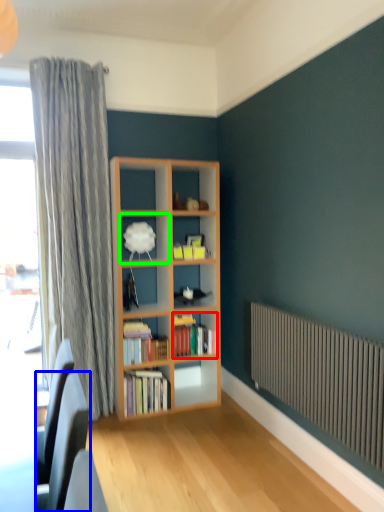
Question: Considering the real-world distances, which object is closest to book (highlighted by a red box)? swivel chair (highlighted by a blue box) or shelf (highlighted by a green box).

Choices:
 (A) swivel chair
 (B) shelf

Answer: (B)